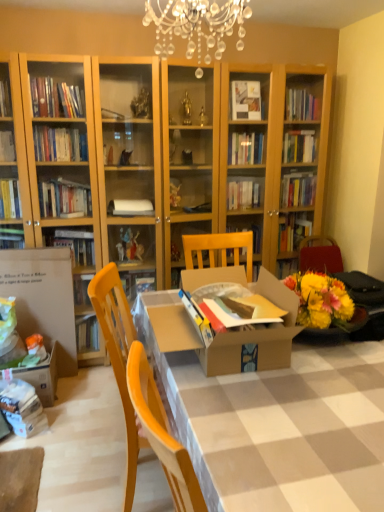
Question: Based on their positions, is brown cardboard table at center located to the left or right of cardboard box at center?

Choices:
 (A) left
 (B) right

Answer: (A)

Question: Looking at their shapes, would you say brown cardboard table at center is wider or thinner than cardboard box at center?

Choices:
 (A) thin
 (B) wide

Answer: (A)

Question: Based on their relative distances, which object is nearer to the white cardboard box at left?

Choices:
 (A) wooden chair at center
 (B) cardboard box at center
 (C) brown cardboard table at center

Answer: (C)

Question: Which is nearer to the white cardboard box at left?

Choices:
 (A) cardboard box at center
 (B) brown cardboard table at center
 (C) wooden chair at center

Answer: (B)